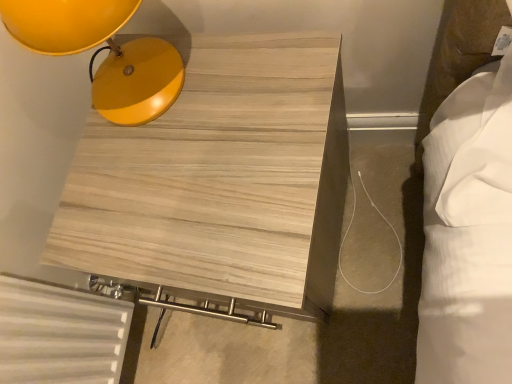
Question: Considering the relative positions of light wood/texture side table at upper left and matte yellow lampshade at upper left in the image provided, is light wood/texture side table at upper left in front of matte yellow lampshade at upper left?

Choices:
 (A) yes
 (B) no

Answer: (B)

Question: Is light wood/texture side table at upper left at the left side of matte yellow lampshade at upper left?

Choices:
 (A) yes
 (B) no

Answer: (B)

Question: Is light wood/texture side table at upper left not inside matte yellow lampshade at upper left?

Choices:
 (A) yes
 (B) no

Answer: (A)

Question: Is light wood/texture side table at upper left wider than matte yellow lampshade at upper left?

Choices:
 (A) no
 (B) yes

Answer: (B)

Question: Considering the relative sizes of light wood/texture side table at upper left and matte yellow lampshade at upper left in the image provided, is light wood/texture side table at upper left taller than matte yellow lampshade at upper left?

Choices:
 (A) yes
 (B) no

Answer: (A)

Question: From the image's perspective, does light wood/texture side table at upper left appear lower than matte yellow lampshade at upper left?

Choices:
 (A) no
 (B) yes

Answer: (B)

Question: Can you confirm if matte yellow lampshade at upper left is positioned to the left of light wood/texture side table at upper left?

Choices:
 (A) yes
 (B) no

Answer: (A)

Question: Is matte yellow lampshade at upper left touching light wood/texture side table at upper left?

Choices:
 (A) no
 (B) yes

Answer: (A)

Question: Can you confirm if matte yellow lampshade at upper left is wider than light wood/texture side table at upper left?

Choices:
 (A) yes
 (B) no

Answer: (B)

Question: Is matte yellow lampshade at upper left bigger than light wood/texture side table at upper left?

Choices:
 (A) yes
 (B) no

Answer: (B)

Question: From a real-world perspective, is matte yellow lampshade at upper left physically above light wood/texture side table at upper left?

Choices:
 (A) no
 (B) yes

Answer: (B)

Question: Is light wood/texture side table at upper left surrounded by matte yellow lampshade at upper left?

Choices:
 (A) yes
 (B) no

Answer: (B)

Question: Looking at the image, does matte yellow lampshade at upper left seem bigger or smaller compared to light wood/texture side table at upper left?

Choices:
 (A) big
 (B) small

Answer: (B)